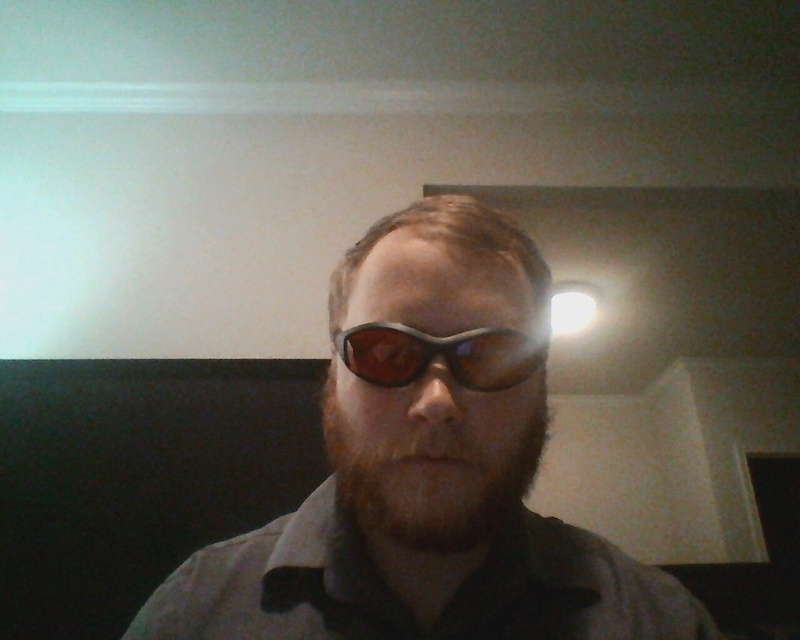
Question: Can you confirm if matte black sunglasses at center is positioned to the right of matte black goggles at center?

Choices:
 (A) no
 (B) yes

Answer: (B)

Question: In this image, where is matte black sunglasses at center located relative to matte black goggles at center?

Choices:
 (A) right
 (B) left

Answer: (A)

Question: Which object appears farthest from the camera in this image?

Choices:
 (A) matte black goggles at center
 (B) matte black sunglasses at center
 (C) brown fuzzy beard at center

Answer: (A)

Question: Which of the following is the closest to the observer?

Choices:
 (A) click(513, 344)
 (B) click(385, 516)
 (C) click(360, 545)

Answer: (A)

Question: Does brown fuzzy beard at center lie in front of matte black goggles at center?

Choices:
 (A) yes
 (B) no

Answer: (A)

Question: Estimate the real-world distances between objects in this image. Which object is farther from the matte black sunglasses at center?

Choices:
 (A) brown fuzzy beard at center
 (B) matte black goggles at center

Answer: (B)